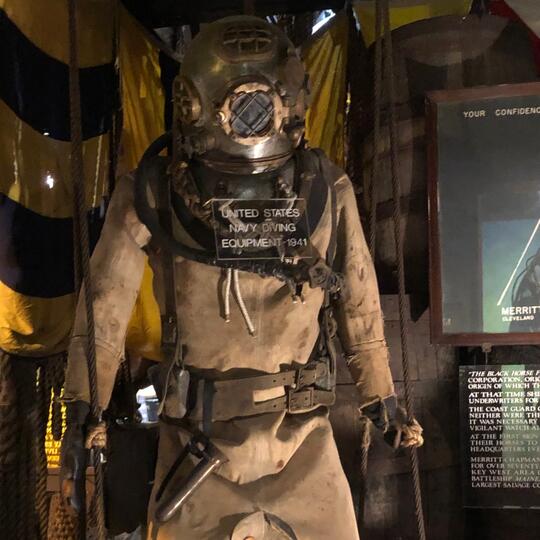
You are a GUI agent. You are given a task and a screenshot of the screen. Output one action in this format:
    pyautogui.click(x=<x>, y=<y>)
    Task: Click on the screen
    The width and height of the screenshot is (540, 540).
    Given the screenshot: What is the action you would take?
    pyautogui.click(x=452, y=172)